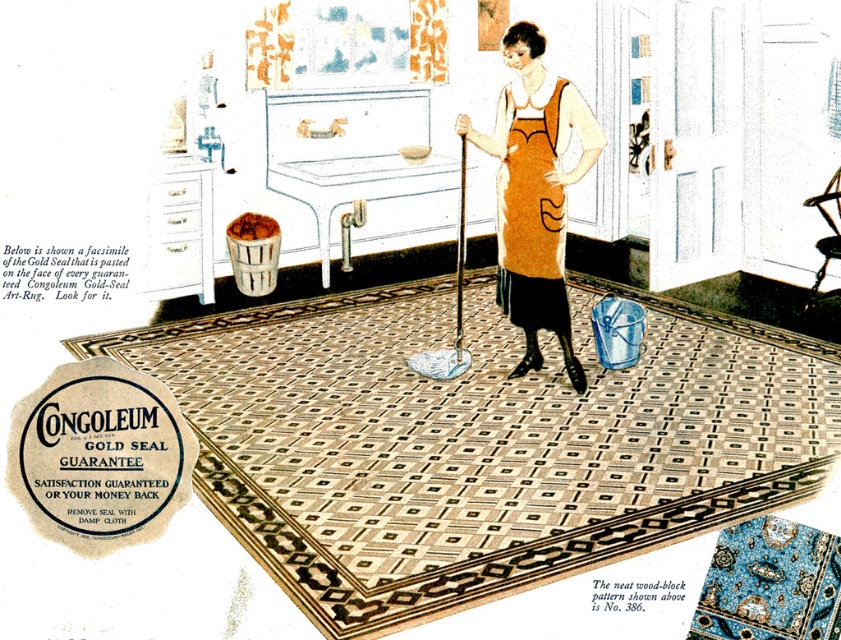
Question: Which point is farther from the camera taking this photo?

Choices:
 (A) (522, 268)
 (B) (577, 177)

Answer: (A)

Question: Does orange fabric dress at center have a larger size compared to orange fabric apron at center?

Choices:
 (A) no
 (B) yes

Answer: (B)

Question: Among these objects, which one is farthest from the camera?

Choices:
 (A) orange fabric apron at center
 (B) orange fabric dress at center

Answer: (A)

Question: Can you confirm if orange fabric dress at center is positioned to the right of orange fabric apron at center?

Choices:
 (A) yes
 (B) no

Answer: (A)

Question: Can you confirm if orange fabric dress at center is positioned above orange fabric apron at center?

Choices:
 (A) yes
 (B) no

Answer: (B)